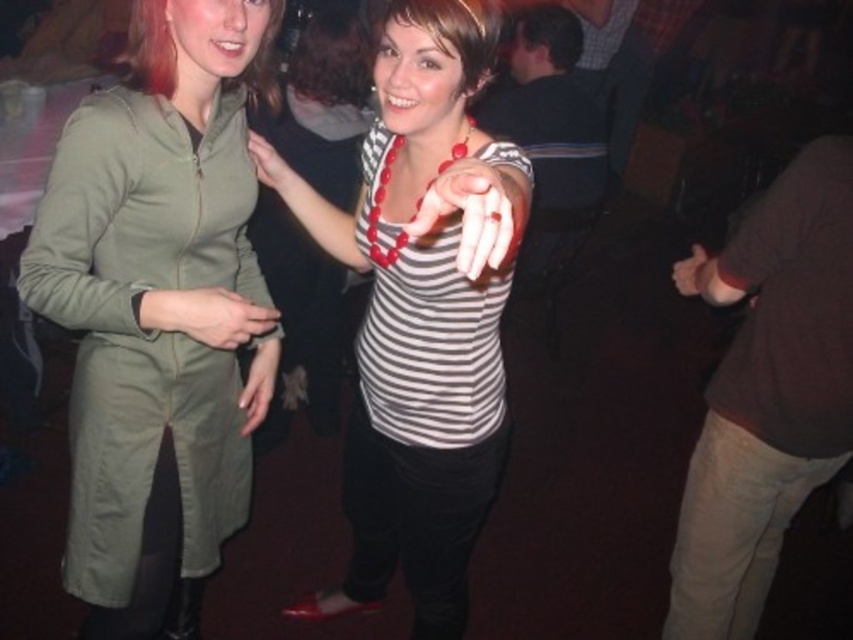
Who is taller, matte green jacket at upper left or matte black hand at center?

matte black hand at center

Does matte green jacket at upper left appear under matte black hand at center?

Actually, matte green jacket at upper left is above matte black hand at center.

Find the location of `matte green jacket at upper left`. matte green jacket at upper left is located at coordinates 271,164.

Can you confirm if olive green fabric jacket at left is bigger than matte black hand at center?

Indeed, olive green fabric jacket at left has a larger size compared to matte black hand at center.

Does point (181, 97) come behind point (680, 285)?

No, it is in front of (680, 285).

In order to click on olive green fabric jacket at left in this screenshot , I will do `click(151, 308)`.

Based on the photo, is striped jersey at center wider than matte black hand at center?

Yes.

Between striped jersey at center and matte black hand at center, which one appears on the right side from the viewer's perspective?

matte black hand at center is more to the right.

Who is more distant from viewer, (x=450, y=480) or (x=701, y=253)?

Point (x=701, y=253)

Locate an element on the screen. The image size is (853, 640). striped jersey at center is located at coordinates (425, 314).